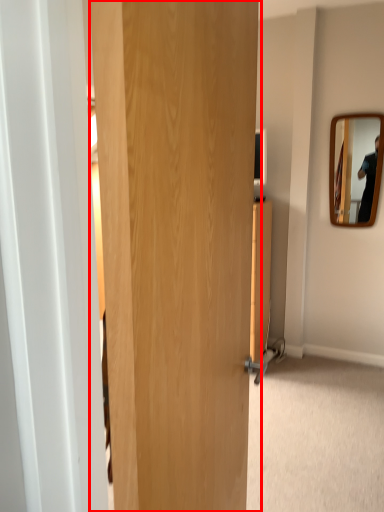
Question: From the image, what is the correct spatial relationship of door (annotated by the red box) in relation to mirror?

Choices:
 (A) left
 (B) right

Answer: (A)